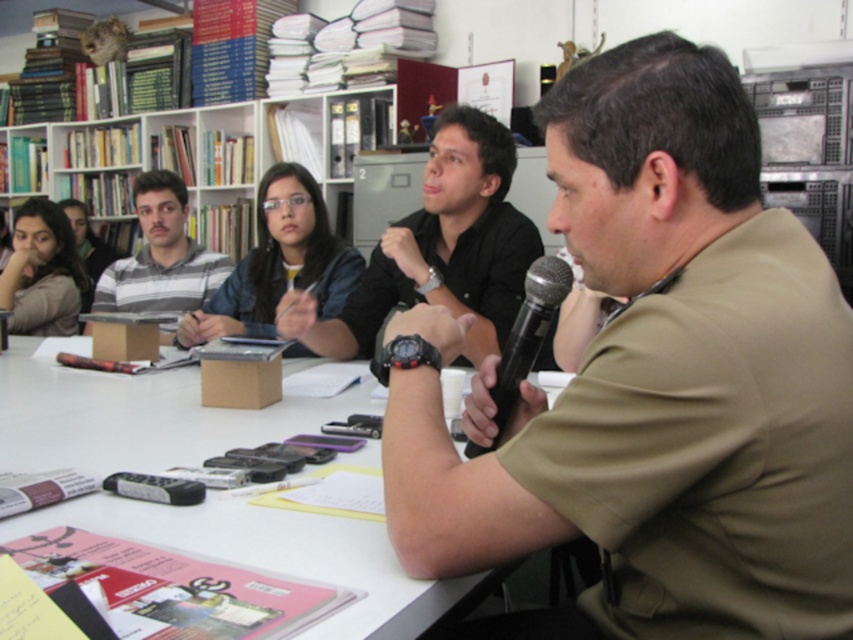
What do you see at coordinates (654, 381) in the screenshot? I see `khaki shirt at center` at bounding box center [654, 381].

Which is above, khaki shirt at center or denim jacket at center?

denim jacket at center

Where is `khaki shirt at center`? This screenshot has height=640, width=853. khaki shirt at center is located at coordinates (654, 381).

Which is above, white paper at center or striped cotton shirt at left?

striped cotton shirt at left is above.

Does white paper at center come behind striped cotton shirt at left?

No, white paper at center is in front of striped cotton shirt at left.

Who is more distant from viewer, (189, 396) or (138, 259)?

The point (138, 259) is more distant.

Identify the location of white paper at center. (134, 417).

Who is shorter, denim jacket at center or striped cotton shirt at left?

With less height is denim jacket at center.

This screenshot has width=853, height=640. Describe the element at coordinates (279, 260) in the screenshot. I see `denim jacket at center` at that location.

Where is `denim jacket at center`? denim jacket at center is located at coordinates (279, 260).